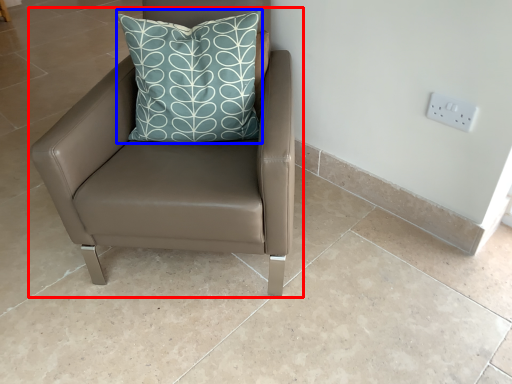
Question: Which point is closer to the camera, chair (highlighted by a red box) or pillow (highlighted by a blue box)?

Choices:
 (A) chair
 (B) pillow

Answer: (A)